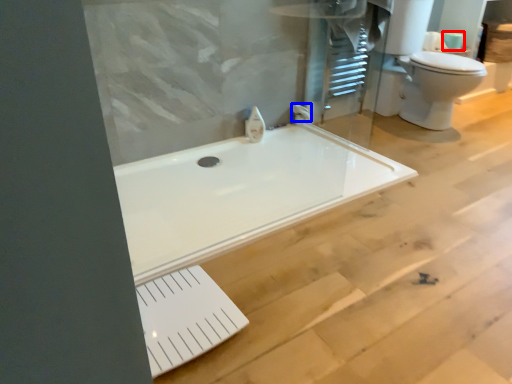
Question: Among these objects, which one is farthest to the camera, toilet paper (highlighted by a red box) or faucet (highlighted by a blue box)?

Choices:
 (A) toilet paper
 (B) faucet

Answer: (A)